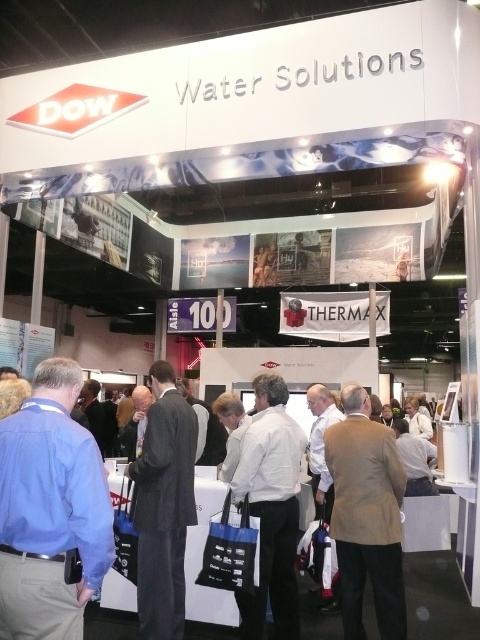
You are a photographer at the exhibition and want to capture a clear photo of the white matte shirt at center without the tan fabric jacket at center blocking it. What should you do?

The tan fabric jacket at center is in front of the white matte shirt at center. To capture a clear photo of the white matte shirt at center without obstruction, you should move the tan fabric jacket at center out of the way or adjust your angle to avoid it.

You are an attendee at the trade show and you see the tan fabric jacket at center and the white matte shirt at center. Which one is positioned to the right side?

The tan fabric jacket at center is positioned to the right of the white matte shirt at center.